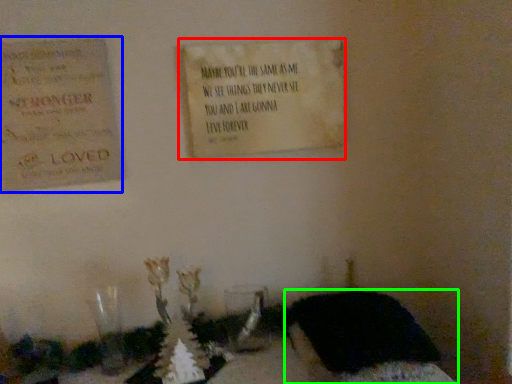
Question: Considering the real-world distances, which object is farthest from notice (highlighted by a red box)? cardboard (highlighted by a blue box) or furniture (highlighted by a green box)?

Choices:
 (A) cardboard
 (B) furniture

Answer: (B)